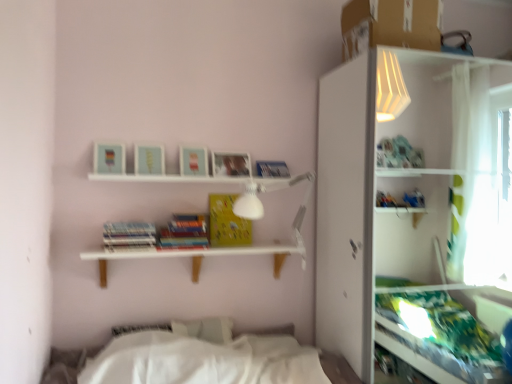
Measure the distance between point (221, 206) and camera.

Point (221, 206) is 8.10 feet away from camera.

The width and height of the screenshot is (512, 384). Describe the element at coordinates (184, 232) in the screenshot. I see `hardcover book at center, which is counted as the second paperback book, starting from the right` at that location.

At what (x,y) coordinates should I click in order to perform the action: click on white matte shelf at center. Please return your answer as a coordinate pair (x, y). Looking at the image, I should click on (194, 255).

Find the location of a particular element. yellow matte paper at center, arranged as the third paperback book when viewed from the left is located at coordinates (227, 222).

Considering the sizes of yellow matte paper at center, arranged as the 1th paperback book when viewed from the right, and white glossy shelf at upper right in the image, is yellow matte paper at center, arranged as the 1th paperback book when viewed from the right, taller or shorter than white glossy shelf at upper right?

Considering their sizes, yellow matte paper at center, arranged as the 1th paperback book when viewed from the right, has less height than white glossy shelf at upper right.

Considering the positions of objects yellow matte paper at center, arranged as the third paperback book when viewed from the left, and white glossy shelf at upper right in the image provided, who is in front, yellow matte paper at center, arranged as the third paperback book when viewed from the left, or white glossy shelf at upper right?

white glossy shelf at upper right.

Is point (242, 218) behind point (474, 222)?

No, (242, 218) is in front of (474, 222).

Considering the positions of objects hardcover books at center, the 3th paperback book in the right-to-left sequence, and white glossy shelf at upper right in the image provided, who is more to the left, hardcover books at center, the 3th paperback book in the right-to-left sequence, or white glossy shelf at upper right?

hardcover books at center, the 3th paperback book in the right-to-left sequence, is more to the left.

Is hardcover books at center, positioned as the 1th paperback book in left-to-right order, turned away from white glossy shelf at upper right?

No, white glossy shelf at upper right is not at the back of hardcover books at center, positioned as the 1th paperback book in left-to-right order.

Can you confirm if hardcover books at center, the 3th paperback book in the right-to-left sequence, is bigger than white glossy shelf at upper right?

No, hardcover books at center, the 3th paperback book in the right-to-left sequence, is not bigger than white glossy shelf at upper right.

Is hardcover books at center, the 3th paperback book in the right-to-left sequence, not close to white glossy shelf at upper right?

That's right, there is a large distance between hardcover books at center, the 3th paperback book in the right-to-left sequence, and white glossy shelf at upper right.

From a real-world perspective, is yellow matte paper at center, arranged as the third paperback book when viewed from the left, beneath hardcover book at center, arranged as the 2th paperback book when viewed from the left?

No, from a real-world perspective, yellow matte paper at center, arranged as the third paperback book when viewed from the left, is not beneath hardcover book at center, arranged as the 2th paperback book when viewed from the left.

Could hardcover book at center, arranged as the 2th paperback book when viewed from the left, be considered to be inside yellow matte paper at center, arranged as the third paperback book when viewed from the left?

No, hardcover book at center, arranged as the 2th paperback book when viewed from the left, is not a part of yellow matte paper at center, arranged as the third paperback book when viewed from the left.

Identify the location of the 1st paperback book counting from the left of the yellow matte paper at center, arranged as the third paperback book when viewed from the left. The image size is (512, 384). (184, 232).

Can you tell me how much white matte shelf at center and hardcover books at center, the 3th paperback book in the right-to-left sequence, differ in facing direction?

There is a 0.551-degree angle between the facing directions of white matte shelf at center and hardcover books at center, the 3th paperback book in the right-to-left sequence.

From the picture: Would you say white matte shelf at center is inside or outside hardcover books at center, positioned as the 1th paperback book in left-to-right order?

white matte shelf at center is not inside hardcover books at center, positioned as the 1th paperback book in left-to-right order, it's outside.

Considering the relative sizes of white matte shelf at center and hardcover books at center, positioned as the 1th paperback book in left-to-right order, in the image provided, is white matte shelf at center wider than hardcover books at center, positioned as the 1th paperback book in left-to-right order,?

Correct, the width of white matte shelf at center exceeds that of hardcover books at center, positioned as the 1th paperback book in left-to-right order.

Does hardcover book at center, arranged as the 2th paperback book when viewed from the left, have a greater width compared to hardcover books at center, the 3th paperback book in the right-to-left sequence?

No.

From the image's perspective, is hardcover book at center, arranged as the 2th paperback book when viewed from the left, located above hardcover books at center, positioned as the 1th paperback book in left-to-right order?

No, from the image's perspective, hardcover book at center, arranged as the 2th paperback book when viewed from the left, is not on top of hardcover books at center, positioned as the 1th paperback book in left-to-right order.

Consider the image. Is hardcover book at center, which is counted as the second paperback book, starting from the right, facing away from hardcover books at center, the 3th paperback book in the right-to-left sequence?

That's not correct — hardcover book at center, which is counted as the second paperback book, starting from the right, is not looking away from hardcover books at center, the 3th paperback book in the right-to-left sequence.

From a real-world perspective, is hardcover book at center, arranged as the 2th paperback book when viewed from the left, above or below hardcover books at center, the 3th paperback book in the right-to-left sequence?

From a real-world perspective, hardcover book at center, arranged as the 2th paperback book when viewed from the left, is physically below hardcover books at center, the 3th paperback book in the right-to-left sequence.

Consider the image. Is yellow matte paper at center, arranged as the third paperback book when viewed from the left, taller or shorter than hardcover books at center, the 3th paperback book in the right-to-left sequence?

In the image, yellow matte paper at center, arranged as the third paperback book when viewed from the left, appears to be taller than hardcover books at center, the 3th paperback book in the right-to-left sequence.

Can you confirm if yellow matte paper at center, arranged as the third paperback book when viewed from the left, is positioned to the right of hardcover books at center, positioned as the 1th paperback book in left-to-right order?

Yes.

Can you confirm if yellow matte paper at center, arranged as the 1th paperback book when viewed from the right, is bigger than hardcover books at center, positioned as the 1th paperback book in left-to-right order?

Actually, yellow matte paper at center, arranged as the 1th paperback book when viewed from the right, might be smaller than hardcover books at center, positioned as the 1th paperback book in left-to-right order.

Is yellow matte paper at center, arranged as the third paperback book when viewed from the left, positioned with its back to hardcover books at center, positioned as the 1th paperback book in left-to-right order?

No.

From a real-world perspective, is white glossy shelf at upper right positioned under hardcover book at center, arranged as the 2th paperback book when viewed from the left, based on gravity?

Yes.

From the image's perspective, is white glossy shelf at upper right under hardcover book at center, arranged as the 2th paperback book when viewed from the left?

Yes.

Is white glossy shelf at upper right taller than hardcover book at center, arranged as the 2th paperback book when viewed from the left?

Correct, white glossy shelf at upper right is much taller as hardcover book at center, arranged as the 2th paperback book when viewed from the left.

Image resolution: width=512 pixels, height=384 pixels. In order to click on paperback book that is the 2nd one when counting backward from the white glossy shelf at upper right in this screenshot , I will do `click(184, 232)`.

This screenshot has height=384, width=512. In order to click on the 3rd paperback book behind the white glossy shelf at upper right in this screenshot , I will do pos(227,222).

Find the location of a particular element. Image resolution: width=512 pixels, height=384 pixels. shelf that appears in front of the hardcover books at center, positioned as the 1th paperback book in left-to-right order is located at coordinates (411, 211).

Based on their spatial positions, is hardcover book at center, which is counted as the second paperback book, starting from the right, or white glossy shelf at upper right closer to white matte shelf at center?

hardcover book at center, which is counted as the second paperback book, starting from the right, lies closer to white matte shelf at center than the other object.

Estimate the real-world distances between objects in this image. Which object is closer to yellow matte paper at center, arranged as the third paperback book when viewed from the left, hardcover books at center, positioned as the 1th paperback book in left-to-right order, or white glossy shelf at upper right?

Based on the image, hardcover books at center, positioned as the 1th paperback book in left-to-right order, appears to be nearer to yellow matte paper at center, arranged as the third paperback book when viewed from the left.

Looking at this image, estimate the real-world distances between objects in this image. Which object is further from yellow matte paper at center, arranged as the 1th paperback book when viewed from the right, white matte shelf at center or hardcover books at center, the 3th paperback book in the right-to-left sequence?

The object further to yellow matte paper at center, arranged as the 1th paperback book when viewed from the right, is hardcover books at center, the 3th paperback book in the right-to-left sequence.

Looking at the image, which one is located closer to white matte shelf at center, hardcover books at center, positioned as the 1th paperback book in left-to-right order, or hardcover book at center, arranged as the 2th paperback book when viewed from the left?

hardcover book at center, arranged as the 2th paperback book when viewed from the left, lies closer to white matte shelf at center than the other object.

Looking at this image, which object lies further to the anchor point hardcover books at center, the 3th paperback book in the right-to-left sequence, white matte shelf at center or white glossy shelf at upper right?

white glossy shelf at upper right is positioned further to the anchor hardcover books at center, the 3th paperback book in the right-to-left sequence.

Estimate the real-world distances between objects in this image. Which object is further from hardcover books at center, positioned as the 1th paperback book in left-to-right order, yellow matte paper at center, arranged as the third paperback book when viewed from the left, or white glossy shelf at upper right?

Among the two, white glossy shelf at upper right is located further to hardcover books at center, positioned as the 1th paperback book in left-to-right order.

From the image, which object appears to be farther from white glossy shelf at upper right, white matte shelf at center or hardcover books at center, the 3th paperback book in the right-to-left sequence?

The object further to white glossy shelf at upper right is hardcover books at center, the 3th paperback book in the right-to-left sequence.

Which object lies further to the anchor point white matte shelf at center, hardcover books at center, the 3th paperback book in the right-to-left sequence, or yellow matte paper at center, arranged as the 1th paperback book when viewed from the right?

hardcover books at center, the 3th paperback book in the right-to-left sequence, is further to white matte shelf at center.

What are the coordinates of `table between hardcover books at center, positioned as the 1th paperback book in left-to-right order, and yellow matte paper at center, arranged as the 1th paperback book when viewed from the right, from left to right` in the screenshot? It's located at (194, 255).

Locate an element on the screen. This screenshot has width=512, height=384. paperback book between hardcover books at center, the 3th paperback book in the right-to-left sequence, and yellow matte paper at center, arranged as the third paperback book when viewed from the left, from left to right is located at coordinates (184, 232).

Identify the location of paperback book situated between hardcover book at center, which is counted as the second paperback book, starting from the right, and white glossy shelf at upper right from left to right. Image resolution: width=512 pixels, height=384 pixels. (227, 222).

In order to click on paperback book between white matte shelf at center and white glossy shelf at upper right from left to right in this screenshot , I will do `click(227, 222)`.